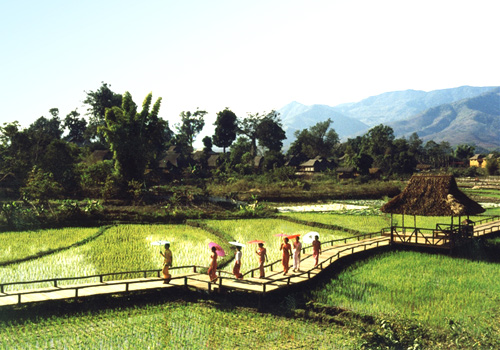
Where is `hand rails`? Image resolution: width=500 pixels, height=350 pixels. hand rails is located at coordinates (126, 285), (121, 274).